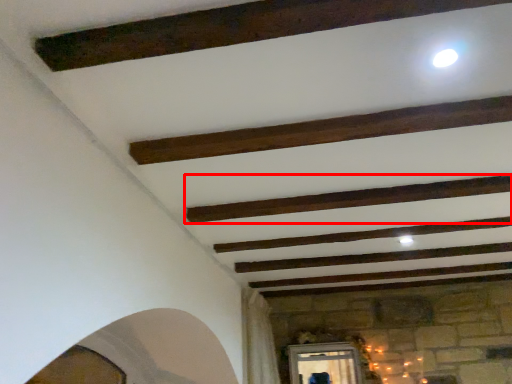
Question: From the image's perspective, where is plank (annotated by the red box) located relative to plank?

Choices:
 (A) below
 (B) above

Answer: (A)